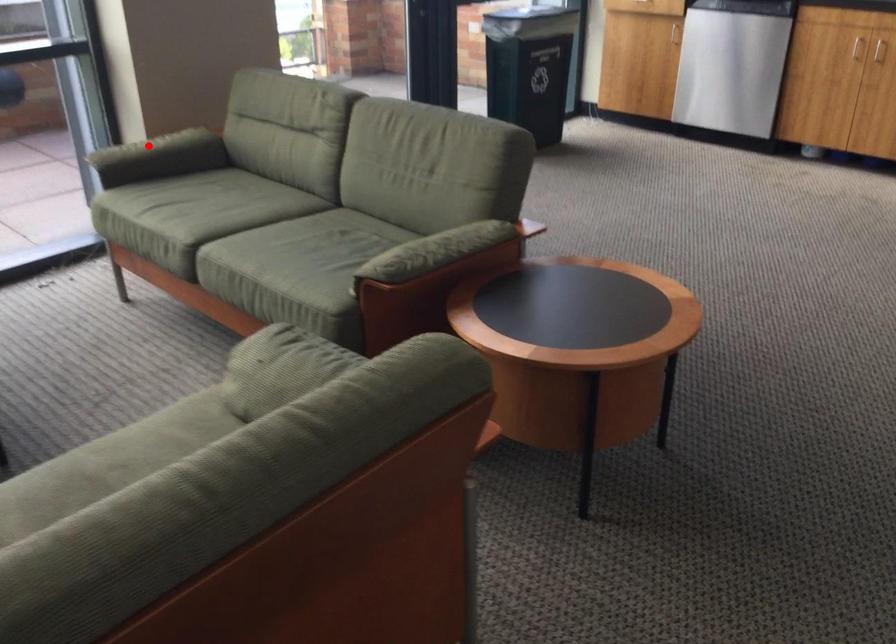
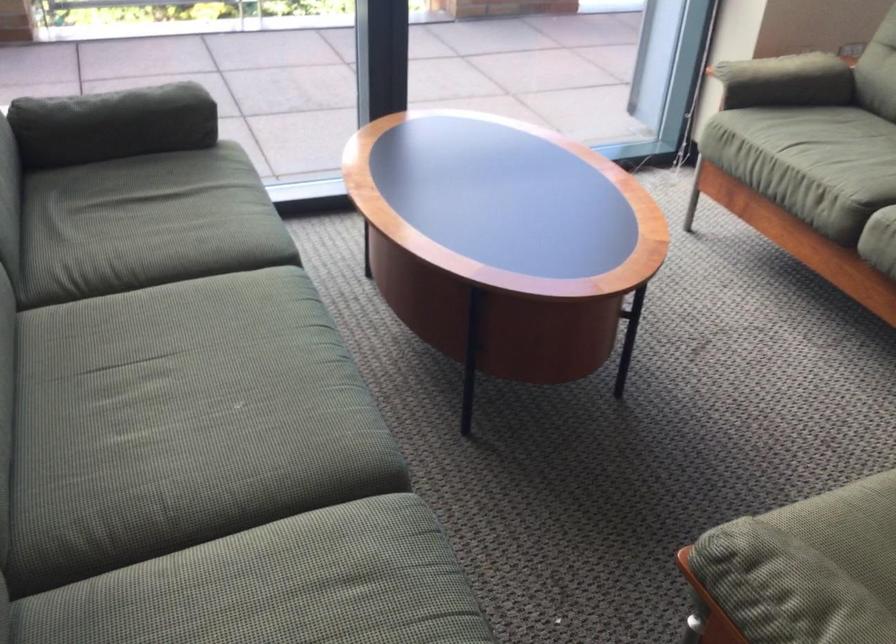
Question: I am providing you with two images of the same scene from different viewpoints. A red point is shown in image1. For the corresponding object point in image2, is it positioned nearer or farther from the camera?

Choices:
 (A) Nearer
 (B) Farther

Answer: (A)